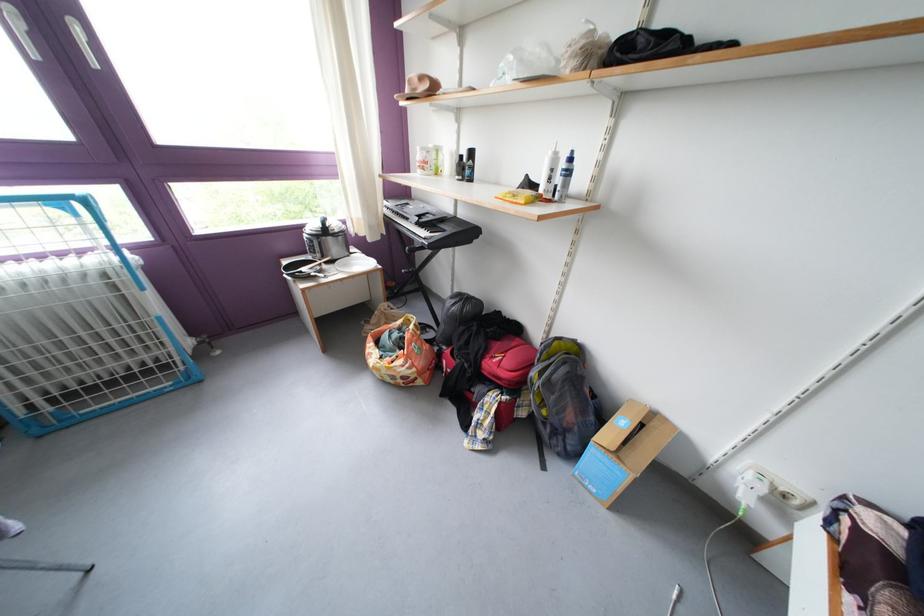
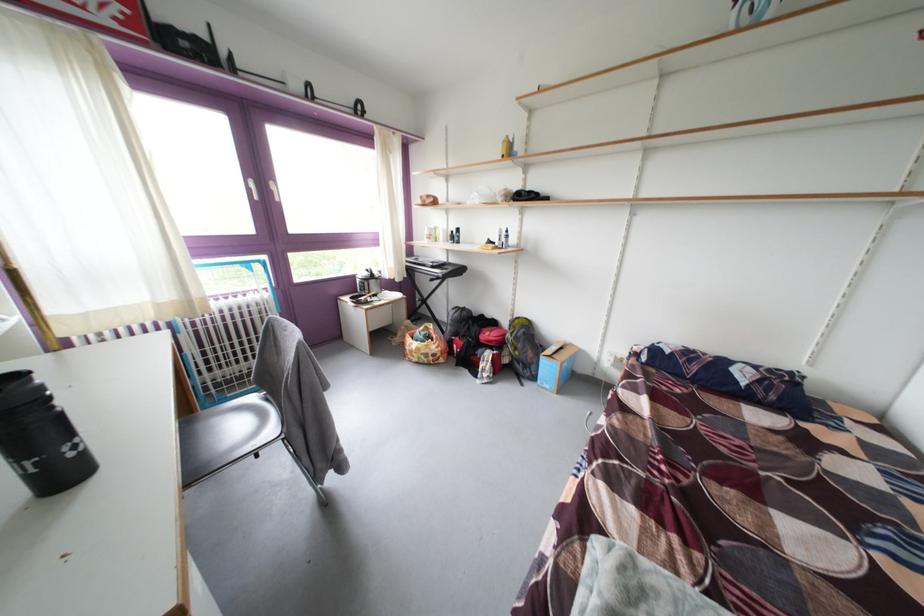
The images are taken continuously from a first-person perspective. In which direction are you moving?

The movement direction of the cameraman is left, backward.